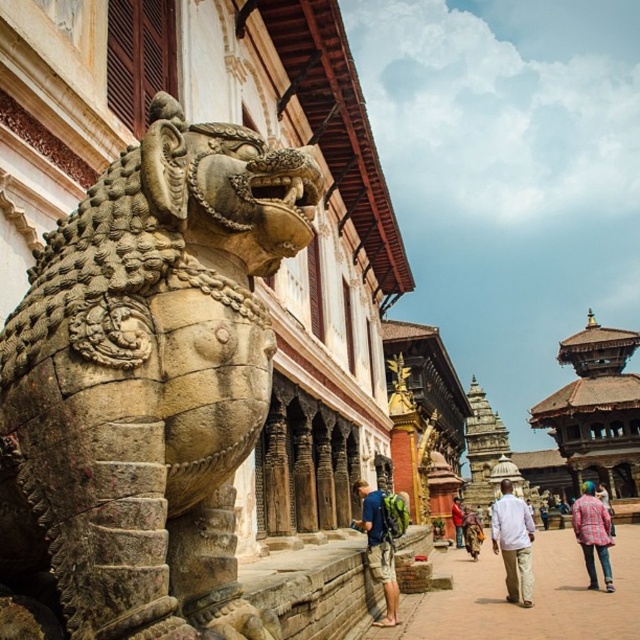
You are a tourist visiting the temple complex and want to take a photo of the white cotton shirt at center while standing next to the stone textured lion at left. Can you stand to the right of the lion to take the photo?

Yes, you can stand to the right of the stone textured lion at left to take the photo of the white cotton shirt at center because the lion is already positioned on the left side of the shirt.